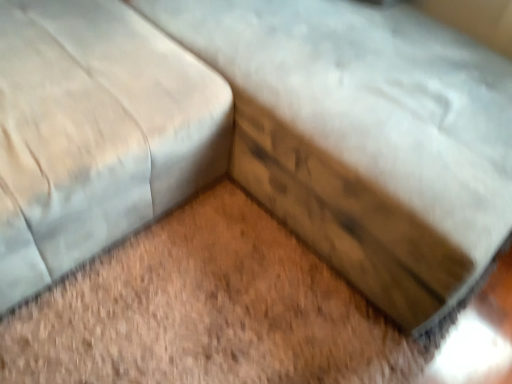
The image size is (512, 384). Describe the element at coordinates (102, 123) in the screenshot. I see `suede-like beige couch at upper left` at that location.

Locate an element on the screen. This screenshot has height=384, width=512. suede-like beige couch at upper left is located at coordinates [x=102, y=123].

You are a GUI agent. You are given a task and a screenshot of the screen. Output one action in this format:
    pyautogui.click(x=<x>, y=<y>)
    Task: Click on the suede-like beige couch at upper left
    
    Given the screenshot: What is the action you would take?
    pyautogui.click(x=102, y=123)